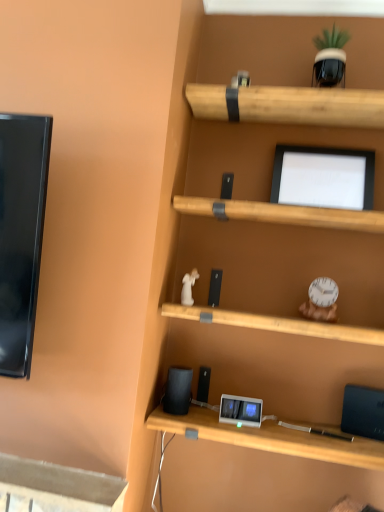
The width and height of the screenshot is (384, 512). Describe the element at coordinates (178, 390) in the screenshot. I see `black matte speaker at lower center` at that location.

Locate an element on the screen. This screenshot has height=512, width=384. black matte speaker at lower center is located at coordinates (178, 390).

Identify the location of black matte computer monitor at upper center. Image resolution: width=384 pixels, height=512 pixels. [x=323, y=177].

What do you see at coordinates (323, 177) in the screenshot? Image resolution: width=384 pixels, height=512 pixels. I see `black matte computer monitor at upper center` at bounding box center [323, 177].

What is the approximate height of black matte computer monitor at upper center?

It is 10.61 inches.

At what (x,y) coordinates should I click in order to perform the action: click on black matte speaker at lower center. Please return your answer as a coordinate pair (x, y). Looking at the image, I should click on click(x=178, y=390).

Which object is positioned more to the right, black matte speaker at lower center or black matte computer monitor at upper center?

Positioned to the right is black matte computer monitor at upper center.

From the picture: Considering their positions, is black matte speaker at lower center located in front of or behind black matte computer monitor at upper center?

In the image, black matte speaker at lower center appears in front of black matte computer monitor at upper center.

Is point (189, 398) farther from viewer compared to point (354, 202)?

No, (189, 398) is in front of (354, 202).

From the image's perspective, between black matte speaker at lower center and black matte computer monitor at upper center, which one is located above?

black matte computer monitor at upper center.

From a real-world perspective, between black matte speaker at lower center and black matte computer monitor at upper center, who is vertically lower?

In real-world perspective, black matte speaker at lower center is lower.

Is black matte speaker at lower center wider or thinner than black matte computer monitor at upper center?

black matte speaker at lower center is thinner than black matte computer monitor at upper center.

Does black matte speaker at lower center have a lesser height compared to black matte computer monitor at upper center?

Yes.

Considering the relative sizes of black matte speaker at lower center and black matte computer monitor at upper center in the image provided, is black matte speaker at lower center bigger than black matte computer monitor at upper center?

Actually, black matte speaker at lower center might be smaller than black matte computer monitor at upper center.

Is black matte speaker at lower center situated inside black matte computer monitor at upper center or outside?

black matte speaker at lower center is not enclosed by black matte computer monitor at upper center.

Is black matte speaker at lower center not near black matte computer monitor at upper center?

No.

Is black matte speaker at lower center looking in the opposite direction of black matte computer monitor at upper center?

No, black matte speaker at lower center is not facing the opposite direction of black matte computer monitor at upper center.

I want to click on speaker beneath the black matte computer monitor at upper center (from a real-world perspective), so click(x=178, y=390).

Looking at this image, can you confirm if black matte computer monitor at upper center is positioned to the left of black matte speaker at lower center?

In fact, black matte computer monitor at upper center is to the right of black matte speaker at lower center.

Which object is closer to the camera, black matte computer monitor at upper center or black matte speaker at lower center?

black matte speaker at lower center.

Considering the points (371, 165) and (185, 412), which point is in front, point (371, 165) or point (185, 412)?

The point (185, 412) is in front.

From the image's perspective, which is below, black matte computer monitor at upper center or black matte speaker at lower center?

black matte speaker at lower center is shown below in the image.

From a real-world perspective, between black matte computer monitor at upper center and black matte speaker at lower center, who is vertically higher?

black matte computer monitor at upper center is physically above.

Does black matte computer monitor at upper center have a lesser width compared to black matte speaker at lower center?

No, black matte computer monitor at upper center is not thinner than black matte speaker at lower center.

Considering the relative sizes of black matte computer monitor at upper center and black matte speaker at lower center in the image provided, is black matte computer monitor at upper center shorter than black matte speaker at lower center?

Incorrect, the height of black matte computer monitor at upper center does not fall short of that of black matte speaker at lower center.

Who is smaller, black matte computer monitor at upper center or black matte speaker at lower center?

With smaller size is black matte speaker at lower center.

Is black matte computer monitor at upper center inside the boundaries of black matte speaker at lower center, or outside?

Result: black matte computer monitor at upper center is located beyond the bounds of black matte speaker at lower center.

Would you say black matte computer monitor at upper center is a long distance from black matte speaker at lower center?

black matte computer monitor at upper center is near black matte speaker at lower center, not far away.

Is black matte computer monitor at upper center positioned with its back to black matte speaker at lower center?

No, black matte computer monitor at upper center's orientation is not away from black matte speaker at lower center.

Measure the distance from black matte computer monitor at upper center to black matte speaker at lower center.

They are 33.07 inches apart.

I want to click on speaker that is in front of the black matte computer monitor at upper center, so click(x=178, y=390).

This screenshot has height=512, width=384. In the image, there is a black matte computer monitor at upper center. In order to click on speaker below it (from a real-world perspective) in this screenshot , I will do `click(178, 390)`.

The width and height of the screenshot is (384, 512). In order to click on speaker lying on the left of black matte computer monitor at upper center in this screenshot , I will do `click(178, 390)`.